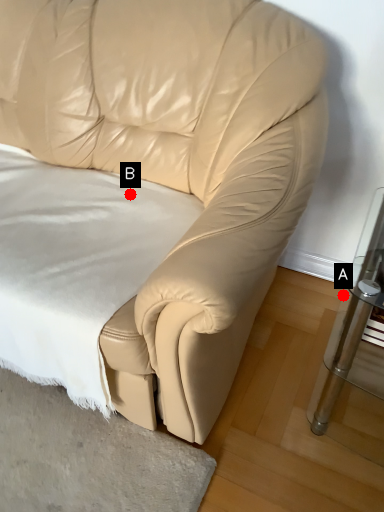
Question: Two points are circled on the image, labeled by A and B beside each circle. Which of the following is the farthest from the observer?

Choices:
 (A) A is further
 (B) B is further

Answer: (A)